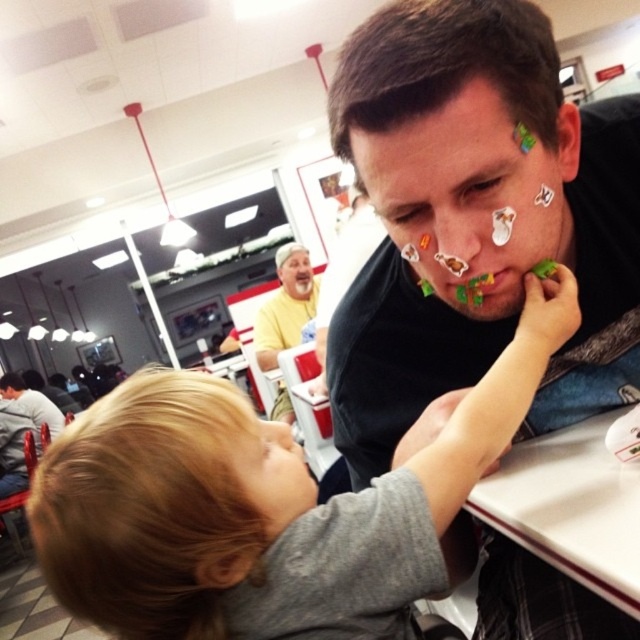
Please look at the point marked at coordinates (260, 506). What can be found there?

The point at coordinates (260, 506) marks the location of blonde hair at center.

You are a customer in this restaurant and you want to place a napkin on the yellow shirt at center to prevent the green matte stickers at mouth center from soiling it. What should you do first?

Place the napkin over the yellow shirt at center since it is larger in size than the green matte stickers at mouth center, ensuring full coverage.